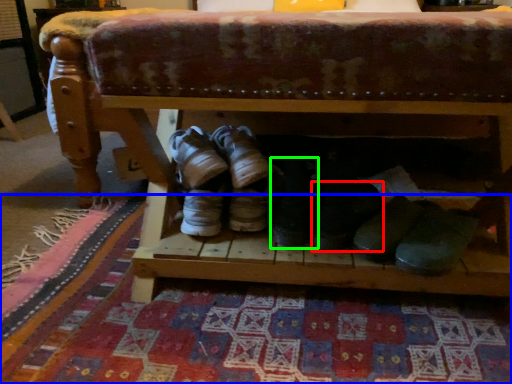
Question: Based on their relative distances, which object is nearer to footwear (highlighted by a red box)? Choose from mat (highlighted by a blue box) and footwear (highlighted by a green box).

Choices:
 (A) mat
 (B) footwear

Answer: (B)